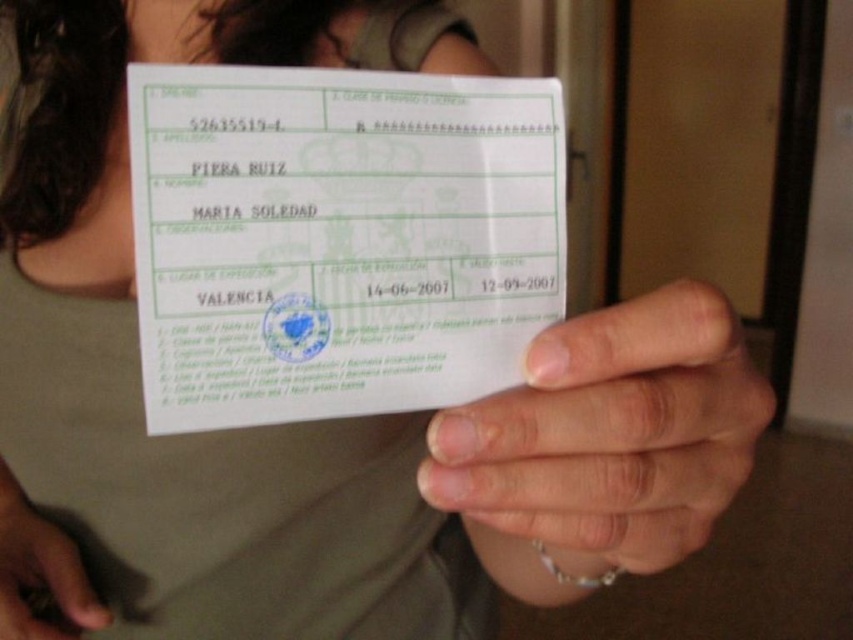
Question: Among these points, which one is farthest from the camera?

Choices:
 (A) (633, 461)
 (B) (70, 573)
 (C) (273, 100)

Answer: (B)

Question: Is white paper receipt at center wider than matte silver ring at lower left?

Choices:
 (A) no
 (B) yes

Answer: (B)

Question: Does white paper receipt at center have a greater width compared to smooth skin at center?

Choices:
 (A) no
 (B) yes

Answer: (B)

Question: Estimate the real-world distances between objects in this image. Which object is closer to the smooth skin at center?

Choices:
 (A) matte silver ring at lower left
 (B) white paper receipt at center

Answer: (B)

Question: Considering the real-world distances, which object is closest to the matte silver ring at lower left?

Choices:
 (A) smooth skin at center
 (B) white paper receipt at center

Answer: (B)

Question: Can you confirm if white paper receipt at center is thinner than matte silver ring at lower left?

Choices:
 (A) yes
 (B) no

Answer: (B)